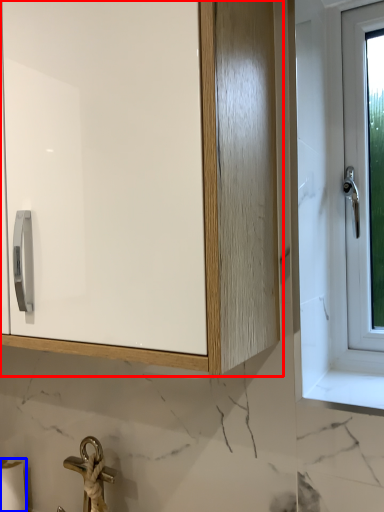
Question: Which object is closer to the camera taking this photo, cabinetry (highlighted by a red box) or toilet paper (highlighted by a blue box)?

Choices:
 (A) cabinetry
 (B) toilet paper

Answer: (A)